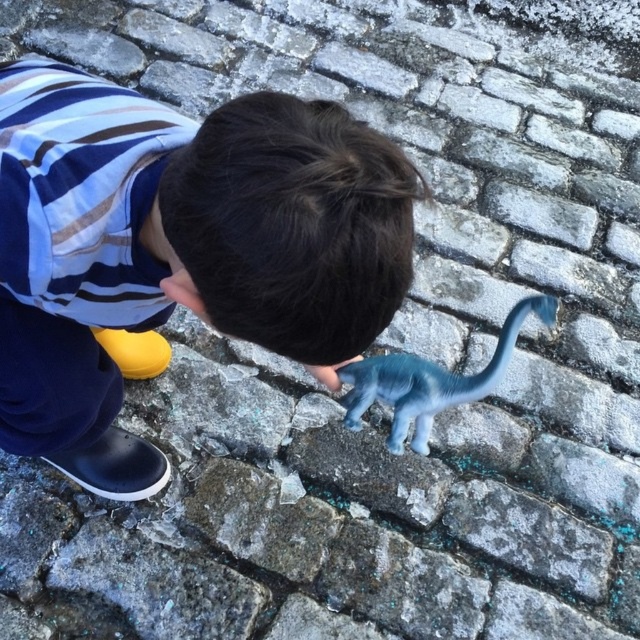
You are helping a child organize their toys. You see the blue rubber boots at lower left and the blue rubber dinosaur at center. Which one is bigger?

The blue rubber boots at lower left are larger in size compared to the blue rubber dinosaur at center.

You are a parent looking for your child in a park. You see the blue rubber boots at lower left and the blue rubber dinosaur at center. Which object is closer to you?

The blue rubber boots at lower left are closer to you because they are positioned over the blue rubber dinosaur at center, indicating they are in front.